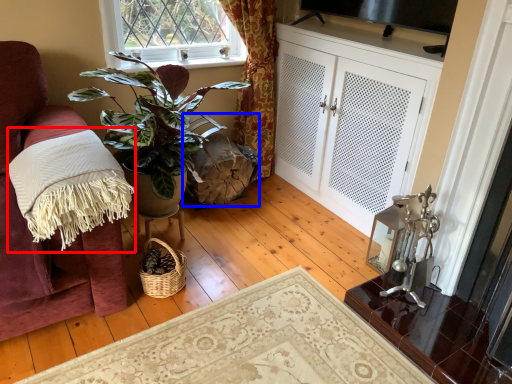
Question: Which object appears farthest to the camera in this image, blanket (highlighted by a red box) or swivel chair (highlighted by a blue box)?

Choices:
 (A) blanket
 (B) swivel chair

Answer: (B)